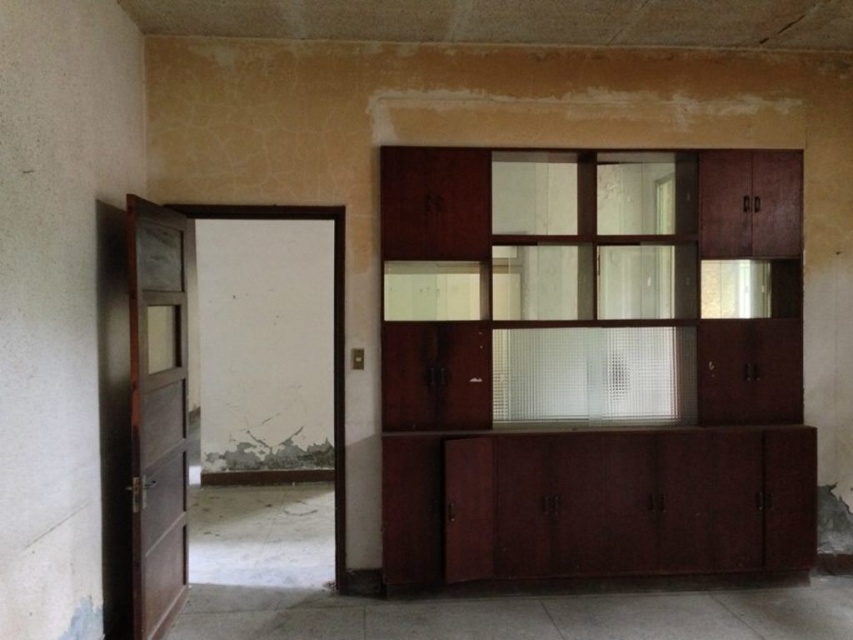
Who is positioned more to the right, mahogany wood cabinet at right or brown wooden door at left?

mahogany wood cabinet at right

Can you confirm if mahogany wood cabinet at right is smaller than brown wooden door at left?

No.

Does point (454, 211) come farther from viewer compared to point (126, 198)?

Yes.

This screenshot has width=853, height=640. What are the coordinates of `mahogany wood cabinet at right` in the screenshot? It's located at (592, 385).